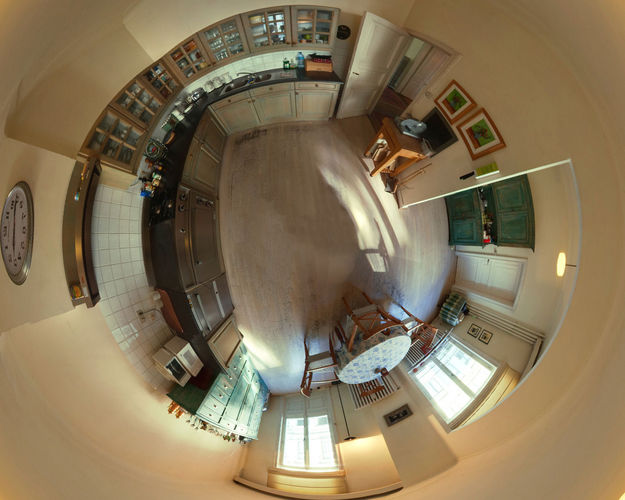
Locate an element on the screen. chair is located at coordinates (318, 360), (362, 318), (417, 324), (372, 389).